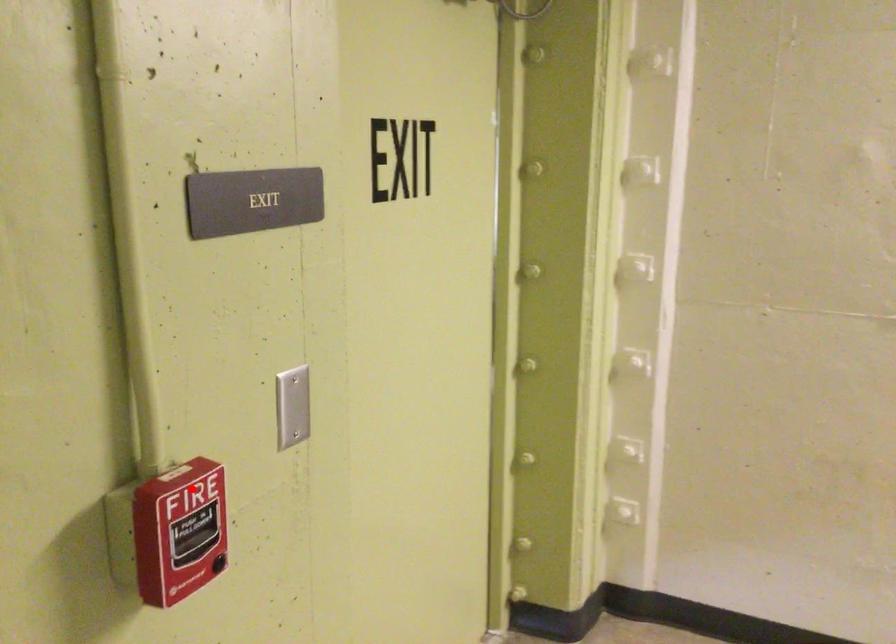
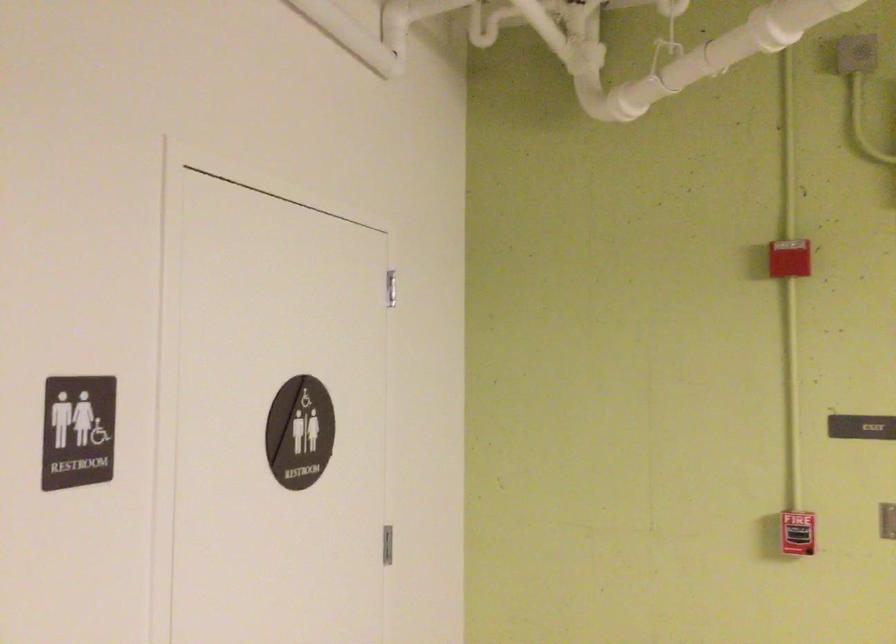
Where in the second image is the point corresponding to the highlighted location from the first image?

(797, 533)